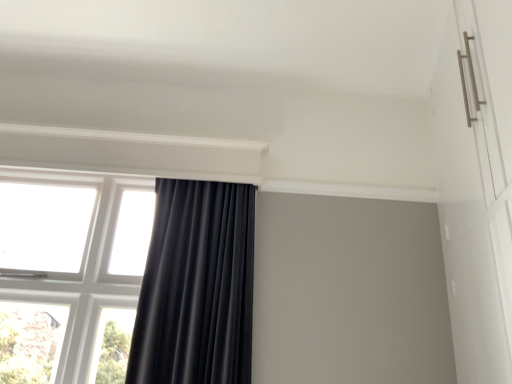
This screenshot has height=384, width=512. Identify the location of black velvet curtain at center. (196, 287).

Describe the element at coordinates (196, 287) in the screenshot. I see `black velvet curtain at center` at that location.

Image resolution: width=512 pixels, height=384 pixels. What are the coordinates of `transparent glass window at left` in the screenshot? It's located at (70, 274).

What do you see at coordinates (70, 274) in the screenshot? I see `transparent glass window at left` at bounding box center [70, 274].

The image size is (512, 384). I want to click on black velvet curtain at center, so click(x=196, y=287).

Does black velvet curtain at center appear on the right side of transparent glass window at left?

Yes.

In the image, is black velvet curtain at center positioned in front of or behind transparent glass window at left?

black velvet curtain at center is positioned closer to the viewer than transparent glass window at left.

Which point is more distant from viewer, (196,354) or (76,290)?

The point (76,290) is farther from the camera.

From the image's perspective, is black velvet curtain at center below transparent glass window at left?

No.

From a real-world perspective, is black velvet curtain at center positioned over transparent glass window at left based on gravity?

No.

Is black velvet curtain at center thinner than transparent glass window at left?

In fact, black velvet curtain at center might be wider than transparent glass window at left.

Who is shorter, black velvet curtain at center or transparent glass window at left?

black velvet curtain at center.

From the picture: Can you confirm if black velvet curtain at center is bigger than transparent glass window at left?

Correct, black velvet curtain at center is larger in size than transparent glass window at left.

Does black velvet curtain at center contain transparent glass window at left?

Definitely not — transparent glass window at left is not inside black velvet curtain at center.

Are black velvet curtain at center and transparent glass window at left far apart?

No, black velvet curtain at center is not far from transparent glass window at left.

Is black velvet curtain at center oriented away from transparent glass window at left?

black velvet curtain at center does not have its back to transparent glass window at left.

Measure the distance between black velvet curtain at center and transparent glass window at left.

A distance of 17.59 inches exists between black velvet curtain at center and transparent glass window at left.

In the image, there is a black velvet curtain at center. What are the coordinates of `window below it (from the image's perspective)` in the screenshot? It's located at (70, 274).

Visually, is transparent glass window at left positioned to the left or to the right of black velvet curtain at center?

From the image, it's evident that transparent glass window at left is to the left of black velvet curtain at center.

Which is behind, transparent glass window at left or black velvet curtain at center?

transparent glass window at left is further from the camera.

Is point (27, 209) positioned behind point (227, 306)?

That is True.

From the image's perspective, is transparent glass window at left below black velvet curtain at center?

Yes, from the image's perspective, transparent glass window at left is below black velvet curtain at center.

From a real-world perspective, which is physically above, transparent glass window at left or black velvet curtain at center?

From a 3D spatial view, transparent glass window at left is above.

In the scene shown: Between transparent glass window at left and black velvet curtain at center, which one has larger width?

With larger width is black velvet curtain at center.

Is transparent glass window at left taller or shorter than black velvet curtain at center?

transparent glass window at left is taller than black velvet curtain at center.

Who is smaller, transparent glass window at left or black velvet curtain at center?

transparent glass window at left.

Is black velvet curtain at center located within transparent glass window at left?

Actually, black velvet curtain at center is outside transparent glass window at left.

Is transparent glass window at left in contact with black velvet curtain at center?

transparent glass window at left and black velvet curtain at center are not in contact.

Is transparent glass window at left looking in the opposite direction of black velvet curtain at center?

That's not correct — transparent glass window at left is not looking away from black velvet curtain at center.

Can you tell me how much transparent glass window at left and black velvet curtain at center differ in facing direction?

The facing directions of transparent glass window at left and black velvet curtain at center are 2.09 degrees apart.

At what (x,y) coordinates should I click in order to perform the action: click on window above the black velvet curtain at center (from a real-world perspective). Please return your answer as a coordinate pair (x, y). Image resolution: width=512 pixels, height=384 pixels. Looking at the image, I should click on (70, 274).

This screenshot has width=512, height=384. I want to click on window below the black velvet curtain at center (from the image's perspective), so click(70, 274).

Where is `curtain below the transparent glass window at left (from a real-world perspective)`? The height and width of the screenshot is (384, 512). curtain below the transparent glass window at left (from a real-world perspective) is located at coordinates (196, 287).